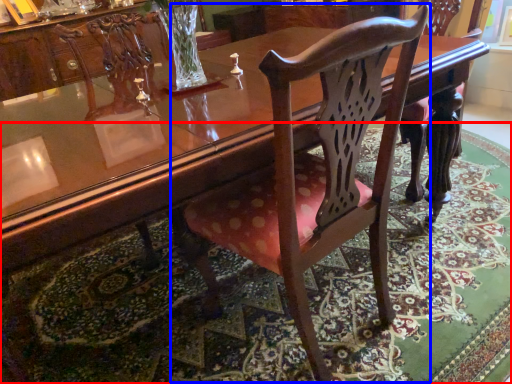
Question: Among these objects, which one is nearest to the camera, mat (highlighted by a red box) or chair (highlighted by a blue box)?

Choices:
 (A) mat
 (B) chair

Answer: (B)